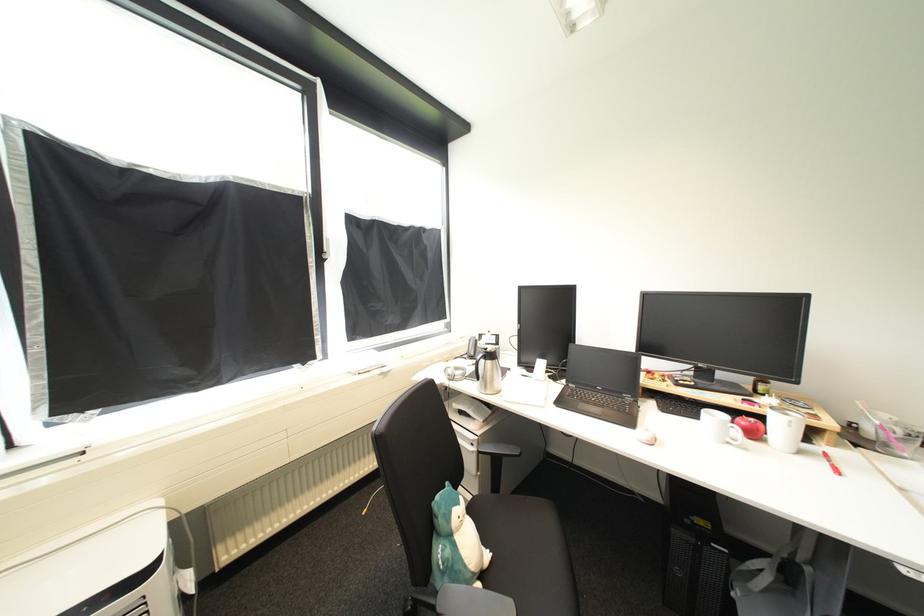
Image resolution: width=924 pixels, height=616 pixels. I want to click on white window handle, so pyautogui.click(x=327, y=248).